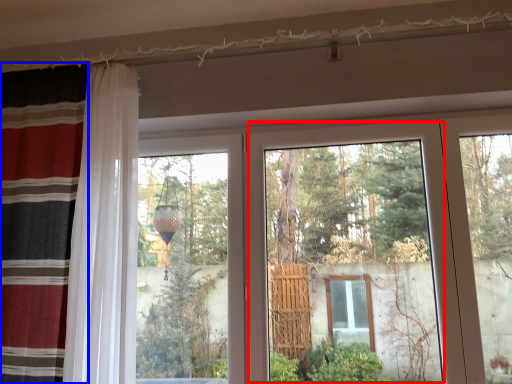
Question: Which object is further to the camera taking this photo, glass door (highlighted by a red box) or curtain (highlighted by a blue box)?

Choices:
 (A) glass door
 (B) curtain

Answer: (A)